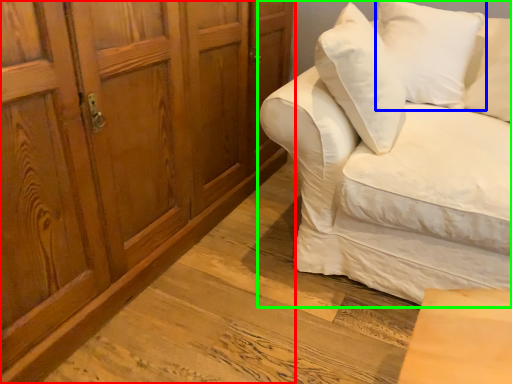
Question: Which object is positioned farthest from cabinetry (highlighted by a red box)? Select from pillow (highlighted by a blue box) and studio couch (highlighted by a green box).

Choices:
 (A) pillow
 (B) studio couch

Answer: (A)